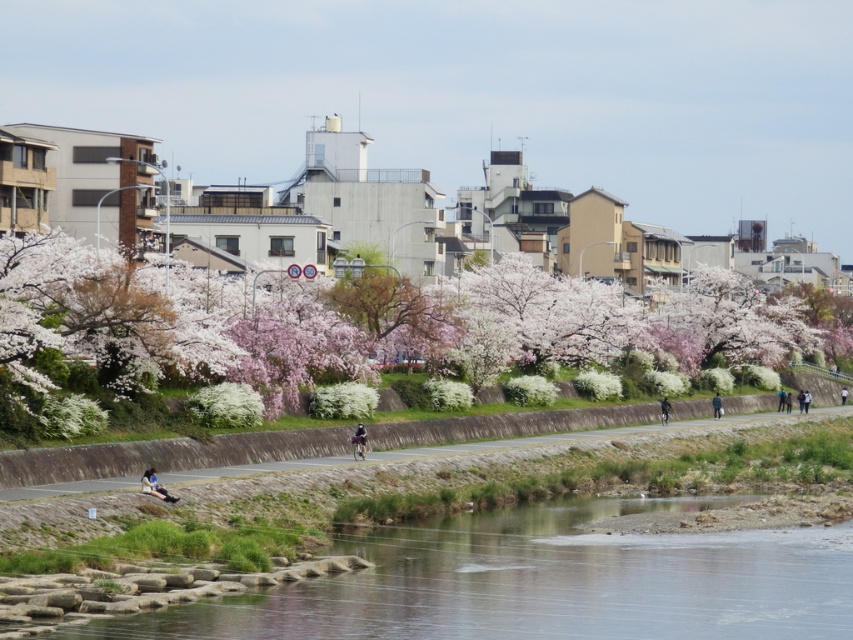
Question: Which object appears farthest from the camera in this image?

Choices:
 (A) matte black jacket at lower left
 (B) white blossoms at center
 (C) black matte bicycle at center-right

Answer: (C)

Question: Estimate the real-world distances between objects in this image. Which object is closer to the dark blue fabric jacket at center?

Choices:
 (A) light blue fabric jacket at center-right
 (B) black matte bicycle at center-right
 (C) white blossoms at center
 (D) light blue fabric person at center-right

Answer: (C)

Question: Which of the following is the closest to the observer?

Choices:
 (A) matte black jacket at lower left
 (B) clear water at river right
 (C) light blue fabric jacket at center-right
 (D) white blossoms at center

Answer: (B)

Question: Does white blossoms at center appear over light blue fabric jacket at center-right?

Choices:
 (A) yes
 (B) no

Answer: (A)

Question: Can you confirm if dark blue fabric jacket at center is thinner than light blue fabric jacket at center-right?

Choices:
 (A) no
 (B) yes

Answer: (B)

Question: Can you confirm if white blossoms at center is positioned to the right of light blue fabric person at center-right?

Choices:
 (A) no
 (B) yes

Answer: (A)